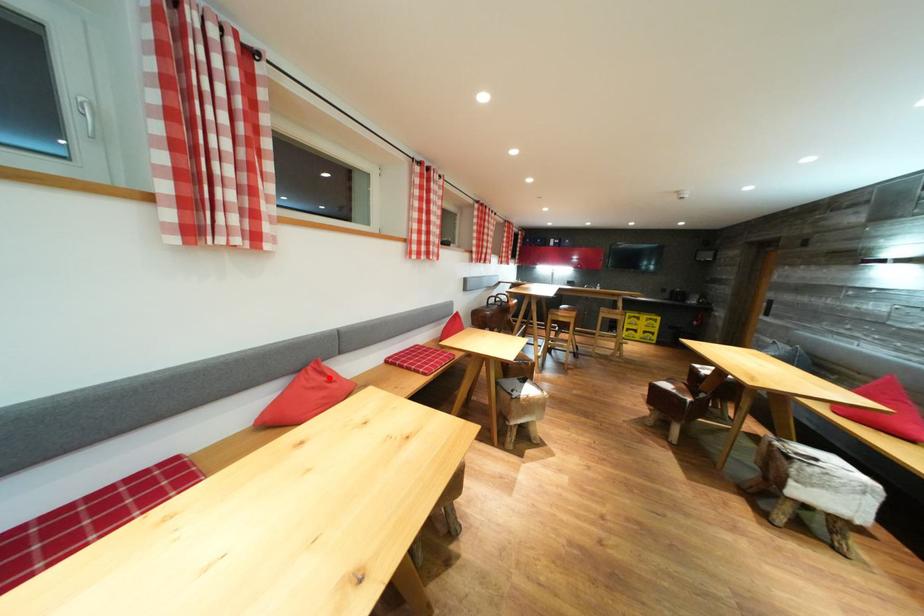
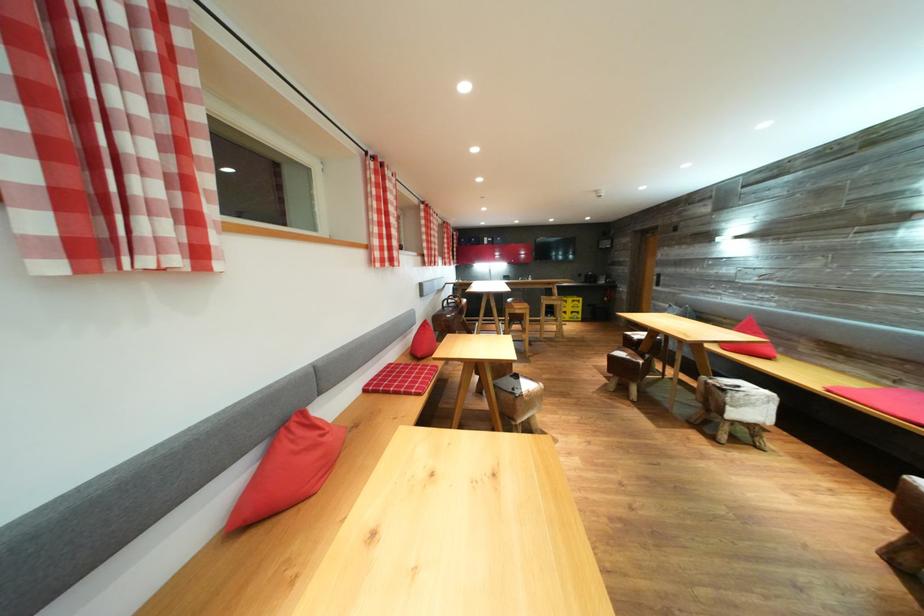
Question: I am providing you with two images of the same scene from different viewpoints. Image1 has a red point marked. In image2, the corresponding 3D location appears at what relative position? Reply with the corresponding letter.

Choices:
 (A) Closer
 (B) Farther

Answer: (A)